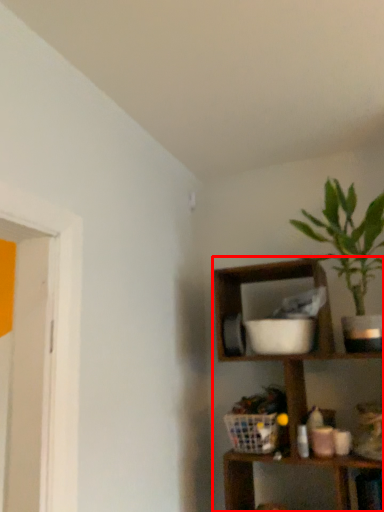
Question: From the image's perspective, what is the correct spatial relationship of shelf (annotated by the red box) in relation to houseplant?

Choices:
 (A) above
 (B) below

Answer: (B)